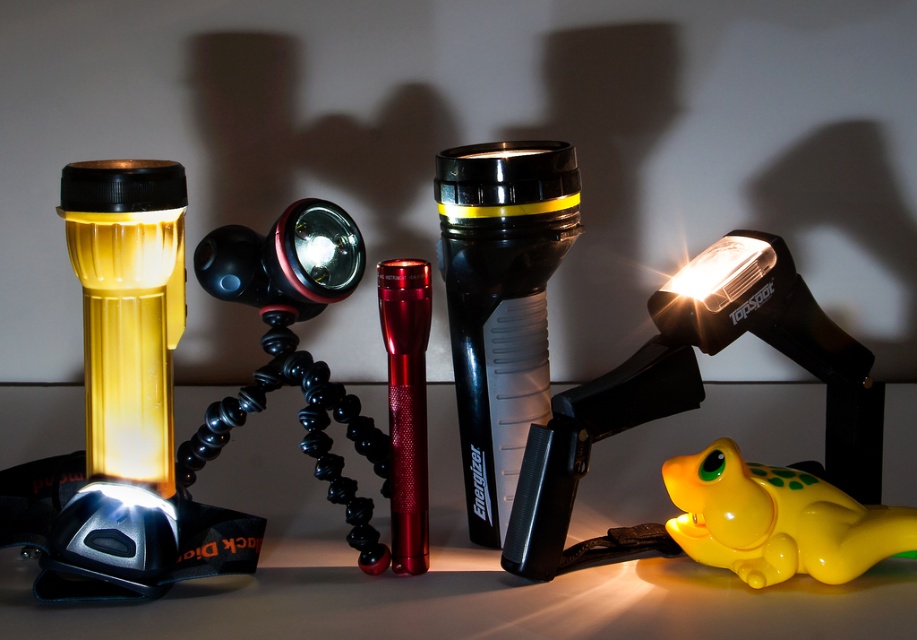
Is yellow rubber frog at center bigger than yellow glossy toy frog at lower right?

Yes, yellow rubber frog at center is bigger than yellow glossy toy frog at lower right.

Looking at this image, can you confirm if yellow rubber frog at center is positioned above yellow glossy toy frog at lower right?

Yes, yellow rubber frog at center is above yellow glossy toy frog at lower right.

Locate an element on the screen. This screenshot has width=917, height=640. yellow rubber frog at center is located at coordinates (694, 394).

Is point (98, 561) farther from viewer compared to point (867, 493)?

That is False.

Between point (76, 548) and point (746, 234), which one is positioned in front?

Point (76, 548)

I want to click on yellow matte flashlight at left, so click(122, 406).

Can you confirm if black plastic flashlight at center is smaller than metallic red flashlight at center?

Actually, black plastic flashlight at center might be larger than metallic red flashlight at center.

This screenshot has height=640, width=917. What are the coordinates of `black plastic flashlight at center` in the screenshot? It's located at (500, 301).

Is point (571, 164) closer to camera compared to point (407, 384)?

That is False.

You are a GUI agent. You are given a task and a screenshot of the screen. Output one action in this format:
    pyautogui.click(x=<x>, y=<y>)
    Task: Click on the black plastic flashlight at center
    Image resolution: width=917 pixels, height=640 pixels.
    Given the screenshot: What is the action you would take?
    pyautogui.click(x=500, y=301)